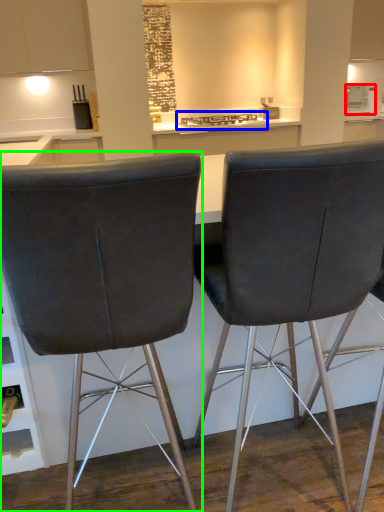
Question: Estimate the real-world distances between objects in this image. Which object is closer to appliance (highlighted by a red box), gas stove (highlighted by a blue box) or chair (highlighted by a green box)?

Choices:
 (A) gas stove
 (B) chair

Answer: (A)